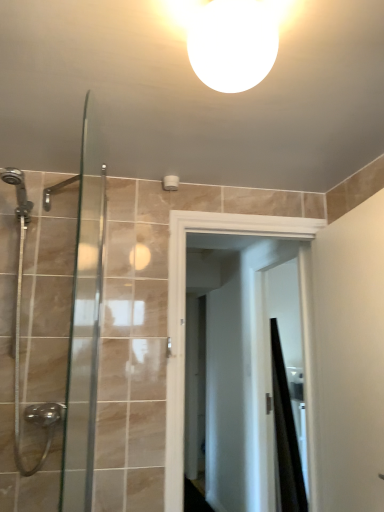
The height and width of the screenshot is (512, 384). What do you see at coordinates (286, 434) in the screenshot?
I see `black matte shower curtain at right` at bounding box center [286, 434].

Describe the element at coordinates (51, 329) in the screenshot. I see `clear glass shower door at left` at that location.

Locate an element on the screen. black matte shower curtain at right is located at coordinates (286, 434).

Is black matte shower curtain at right positioned beyond the bounds of white glossy sink at upper center?

Yes, black matte shower curtain at right is outside of white glossy sink at upper center.

In the scene shown: Is black matte shower curtain at right positioned with its back to white glossy sink at upper center?

No, black matte shower curtain at right is not facing away from white glossy sink at upper center.

In order to click on sink above the black matte shower curtain at right (from a real-world perspective) in this screenshot , I will do `click(296, 383)`.

From a real-world perspective, relative to white glossy sink at upper center, is black matte shower curtain at right vertically above or below?

From a real-world perspective, black matte shower curtain at right is physically below white glossy sink at upper center.

This screenshot has height=512, width=384. I want to click on shower curtain below the clear glass shower door at left (from a real-world perspective), so click(x=286, y=434).

Are clear glass shower door at left and black matte shower curtain at right located far from each other?

clear glass shower door at left is positioned a significant distance from black matte shower curtain at right.

Which is in front, clear glass shower door at left or black matte shower curtain at right?

clear glass shower door at left is more forward.

Is clear glass shower door at left bigger than black matte shower curtain at right?

No.

Identify the location of light fixture that appears above the white glossy sink at upper center (from a real-world perspective). (231, 39).

Is point (293, 2) less distant than point (303, 381)?

Yes.

What's the angular difference between white glossy light fixture at upper center and white glossy sink at upper center's facing directions?

The facing directions of white glossy light fixture at upper center and white glossy sink at upper center are 180 degrees apart.

Which is behind, white glossy light fixture at upper center or white glossy sink at upper center?

white glossy sink at upper center is further away from the camera.

Looking at the image, does clear glass shower door at left seem bigger or smaller compared to matte white screen door at center?

Considering their sizes, clear glass shower door at left takes up less space than matte white screen door at center.

Between clear glass shower door at left and matte white screen door at center, which one has more height?

matte white screen door at center is taller.

From the picture: Would you say clear glass shower door at left is to the left or to the right of matte white screen door at center in the picture?

Based on their positions, clear glass shower door at left is located to the left of matte white screen door at center.

From the image's perspective, which one is positioned higher, clear glass shower door at left or matte white screen door at center?

clear glass shower door at left.

From the picture: From the image's perspective, which one is positioned higher, matte white screen door at center or black matte shower curtain at right?

matte white screen door at center is shown above in the image.

Is point (179, 303) closer or farther from the camera than point (300, 501)?

Point (179, 303).

Identify the location of screen door that appears above the black matte shower curtain at right (from the image's perspective). (185, 313).

From a real-world perspective, relative to clear glass shower door at left, is black matte shower curtain at right vertically above or below?

From a real-world perspective, black matte shower curtain at right is physically below clear glass shower door at left.

From the image's perspective, which is below, black matte shower curtain at right or clear glass shower door at left?

black matte shower curtain at right.

Would you consider black matte shower curtain at right to be distant from clear glass shower door at left?

Yes, black matte shower curtain at right is far from clear glass shower door at left.

Which is behind, white glossy light fixture at upper center or black matte shower curtain at right?

black matte shower curtain at right is behind.

Find the location of a particular element. light fixture located above the black matte shower curtain at right (from a real-world perspective) is located at coordinates [x=231, y=39].

Looking at this image, is white glossy light fixture at upper center positioned far away from black matte shower curtain at right?

Yes, white glossy light fixture at upper center and black matte shower curtain at right are quite far apart.

From a real-world perspective, which object stands above the other?

white glossy light fixture at upper center is physically above.

In the image, there is a black matte shower curtain at right. Identify the location of sink above it (from the image's perspective). (296, 383).

Locate an element on the screen. The image size is (384, 512). shower door in front of the black matte shower curtain at right is located at coordinates (51, 329).

Looking at the image, which one is located closer to matte white screen door at center, black matte shower curtain at right or clear glass shower door at left?

The object closer to matte white screen door at center is clear glass shower door at left.

Considering their positions, is clear glass shower door at left positioned further to black matte shower curtain at right than white glossy sink at upper center?

clear glass shower door at left lies further to black matte shower curtain at right than the other object.

Which object lies nearer to the anchor point black matte shower curtain at right, matte white screen door at center or clear glass shower door at left?

matte white screen door at center lies closer to black matte shower curtain at right than the other object.

Which object lies further to the anchor point white glossy sink at upper center, white glossy light fixture at upper center or black matte shower curtain at right?

The object further to white glossy sink at upper center is white glossy light fixture at upper center.

From the image, which object appears to be farther from white glossy sink at upper center, matte white screen door at center or clear glass shower door at left?

Based on the image, clear glass shower door at left appears to be further to white glossy sink at upper center.

When comparing their distances from matte white screen door at center, does black matte shower curtain at right or white glossy light fixture at upper center seem further?

Among the two, black matte shower curtain at right is located further to matte white screen door at center.

Considering their positions, is white glossy sink at upper center positioned further to matte white screen door at center than black matte shower curtain at right?

white glossy sink at upper center is positioned further to the anchor matte white screen door at center.

Looking at the image, which one is located further to matte white screen door at center, white glossy light fixture at upper center or black matte shower curtain at right?

Among the two, black matte shower curtain at right is located further to matte white screen door at center.

Locate an element on the screen. screen door between white glossy light fixture at upper center and black matte shower curtain at right in the front-back direction is located at coordinates (185, 313).

Find the location of a particular element. The image size is (384, 512). shower door between white glossy light fixture at upper center and matte white screen door at center in the up-down direction is located at coordinates (51, 329).

Where is `shower door between white glossy light fixture at upper center and white glossy sink at upper center along the z-axis`? This screenshot has height=512, width=384. shower door between white glossy light fixture at upper center and white glossy sink at upper center along the z-axis is located at coordinates (51, 329).

Locate an element on the screen. shower curtain between clear glass shower door at left and white glossy sink at upper center along the z-axis is located at coordinates (286, 434).